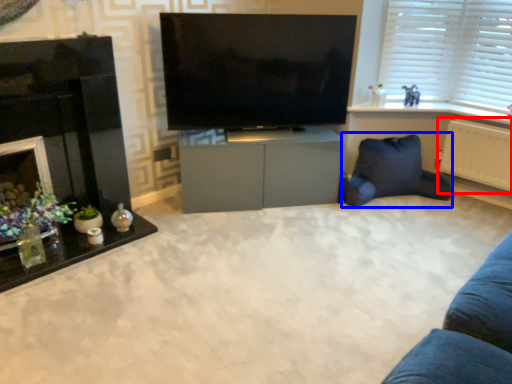
Question: Which of the following is the farthest to the observer, radiator (highlighted by a red box) or bean bag chair (highlighted by a blue box)?

Choices:
 (A) radiator
 (B) bean bag chair

Answer: (B)